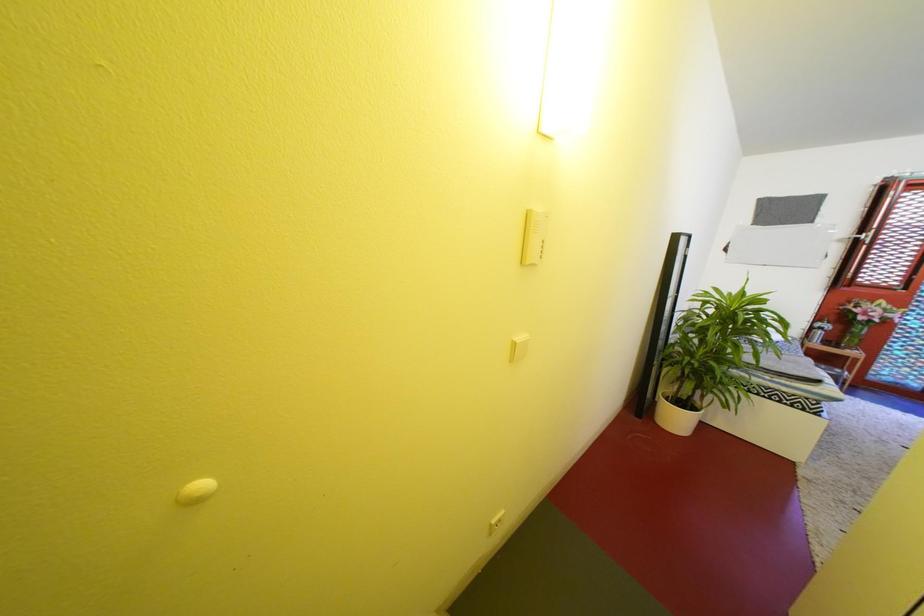
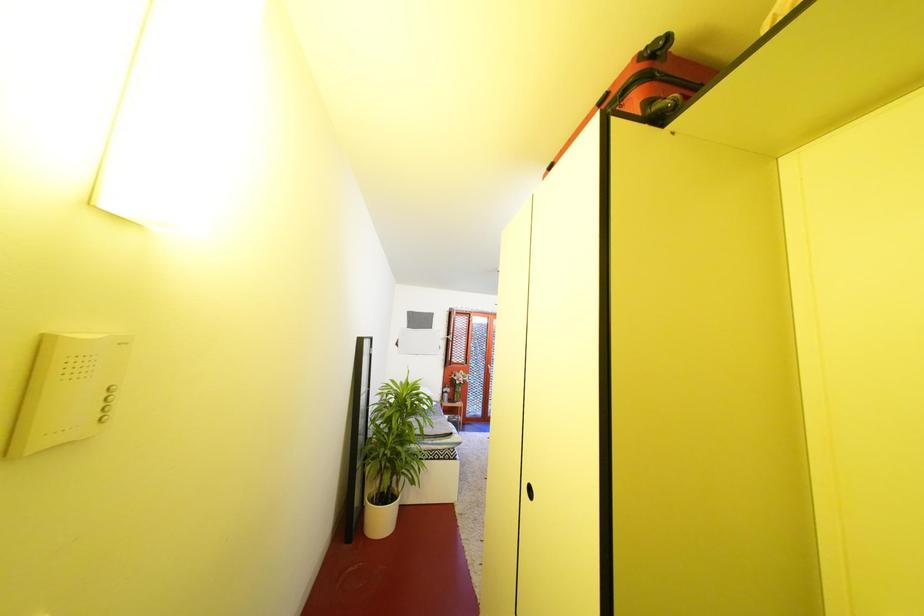
Question: The images are taken continuously from a first-person perspective. In which direction is your viewpoint rotating?

Choices:
 (A) Left
 (B) Right
 (C) Up
 (D) Down

Answer: (B)